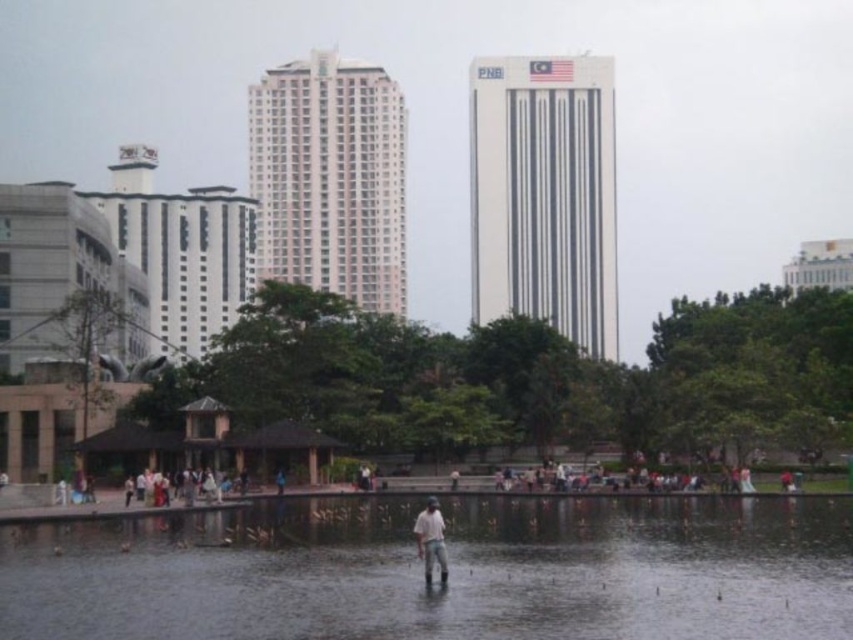
Question: Which object appears farthest from the camera in this image?

Choices:
 (A) transparent water at center
 (B) light brown fabric shirt at center

Answer: (B)

Question: Can you confirm if transparent water at center is positioned above light brown fabric shirt at center?

Choices:
 (A) yes
 (B) no

Answer: (B)

Question: Can you confirm if transparent water at center is positioned above light brown fabric shirt at center?

Choices:
 (A) yes
 (B) no

Answer: (B)

Question: Can you confirm if transparent water at center is positioned to the right of light brown fabric shirt at center?

Choices:
 (A) yes
 (B) no

Answer: (B)